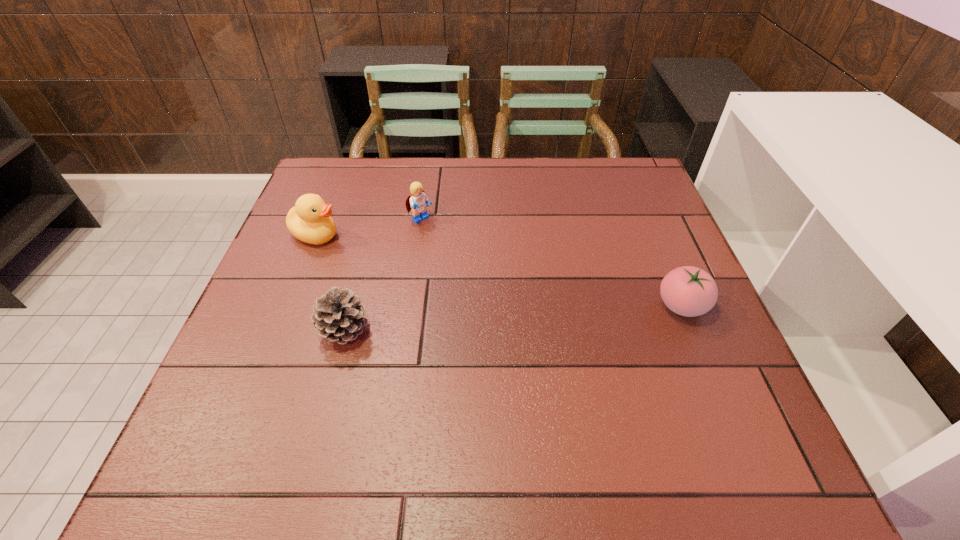
Where is `vacant space located 0.380m on the front-facing side of the Lego`? vacant space located 0.380m on the front-facing side of the Lego is located at coordinates tap(531, 314).

Where is `vacant space located on the front-facing side of the Lego`? vacant space located on the front-facing side of the Lego is located at coordinates (469, 262).

Image resolution: width=960 pixels, height=540 pixels. I want to click on pinecone at the left edge, so click(x=338, y=316).

Locate an element on the screen. The image size is (960, 540). duck positioned at the left edge is located at coordinates (309, 220).

Find the location of a particular element. This screenshot has width=960, height=540. object that is positioned at the right edge is located at coordinates (689, 291).

You are a GUI agent. You are given a task and a screenshot of the screen. Output one action in this format:
    pyautogui.click(x=<x>, y=<y>)
    Task: Click on the vacant space at the far edge of the desktop
    
    Given the screenshot: What is the action you would take?
    pyautogui.click(x=453, y=190)

Identify the location of free region at the near edge of the desktop. The image size is (960, 540). (452, 387).

In order to click on free space at the left edge of the desktop in this screenshot , I will do `click(300, 255)`.

Where is `vacant space at the right edge`? The width and height of the screenshot is (960, 540). vacant space at the right edge is located at coordinates pos(659,239).

This screenshot has height=540, width=960. I want to click on free region at the far left corner, so click(339, 185).